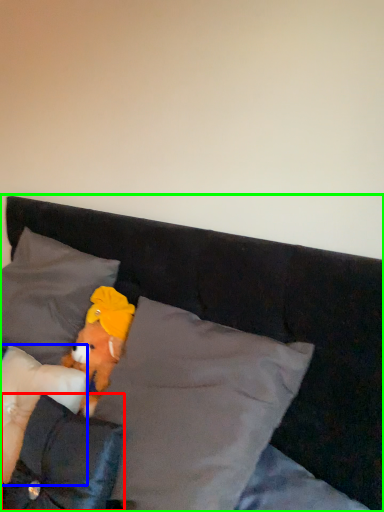
Question: Considering the real-world distances, which object is farthest from pillow (highlighted by a red box)? pillow (highlighted by a blue box) or bed (highlighted by a green box)?

Choices:
 (A) pillow
 (B) bed

Answer: (B)